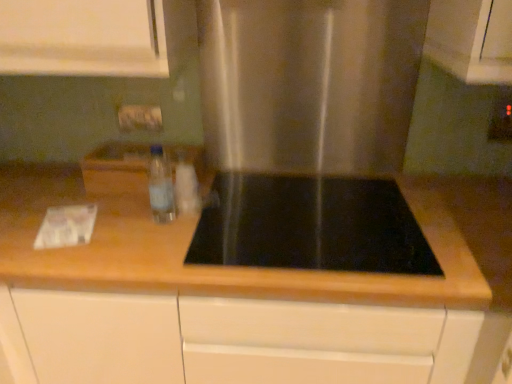
Question: Does translucent plastic bottle at center, acting as the second bottle starting from the left, touch wooden at center?

Choices:
 (A) yes
 (B) no

Answer: (B)

Question: Can you confirm if translucent plastic bottle at center, acting as the second bottle starting from the left, is bigger than wooden at center?

Choices:
 (A) no
 (B) yes

Answer: (A)

Question: Could you tell me if translucent plastic bottle at center, the 1th bottle in the right-to-left sequence, is turned towards wooden at center?

Choices:
 (A) yes
 (B) no

Answer: (B)

Question: Is there a large distance between translucent plastic bottle at center, acting as the second bottle starting from the left, and wooden at center?

Choices:
 (A) yes
 (B) no

Answer: (B)

Question: Considering the relative positions of translucent plastic bottle at center, the 1th bottle in the right-to-left sequence, and wooden at center in the image provided, is translucent plastic bottle at center, the 1th bottle in the right-to-left sequence, to the left of wooden at center from the viewer's perspective?

Choices:
 (A) yes
 (B) no

Answer: (A)

Question: Would you say clear plastic bottle at center, the second bottle viewed from the right, is to the left or to the right of translucent plastic bottle at center, the 1th bottle in the right-to-left sequence, in the picture?

Choices:
 (A) left
 (B) right

Answer: (A)

Question: From a real-world perspective, is clear plastic bottle at center, placed as the first bottle when sorted from left to right, physically located above or below translucent plastic bottle at center, the 1th bottle in the right-to-left sequence?

Choices:
 (A) above
 (B) below

Answer: (A)

Question: Is point (161, 165) closer or farther from the camera than point (179, 200)?

Choices:
 (A) closer
 (B) farther

Answer: (B)

Question: From the image's perspective, is clear plastic bottle at center, placed as the first bottle when sorted from left to right, located above or below translucent plastic bottle at center, acting as the second bottle starting from the left?

Choices:
 (A) above
 (B) below

Answer: (A)

Question: From a real-world perspective, is wooden at center positioned above or below clear plastic bottle at center, the second bottle viewed from the right?

Choices:
 (A) below
 (B) above

Answer: (A)

Question: Is point (26, 170) positioned closer to the camera than point (162, 160)?

Choices:
 (A) farther
 (B) closer

Answer: (A)

Question: From the image's perspective, is wooden at center located above or below clear plastic bottle at center, placed as the first bottle when sorted from left to right?

Choices:
 (A) above
 (B) below

Answer: (B)

Question: In terms of width, does wooden at center look wider or thinner when compared to clear plastic bottle at center, placed as the first bottle when sorted from left to right?

Choices:
 (A) wide
 (B) thin

Answer: (A)

Question: Relative to translucent plastic bottle at center, the 1th bottle in the right-to-left sequence, is matte plastic electric outlet at upper right in front or behind?

Choices:
 (A) behind
 (B) front

Answer: (A)

Question: Is matte plastic electric outlet at upper right inside or outside of translucent plastic bottle at center, the 1th bottle in the right-to-left sequence?

Choices:
 (A) outside
 (B) inside

Answer: (A)